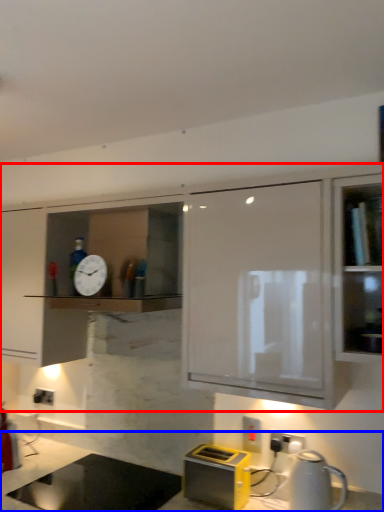
Question: Which point is closer to the camera, cabinetry (highlighted by a red box) or countertop (highlighted by a blue box)?

Choices:
 (A) cabinetry
 (B) countertop

Answer: (B)